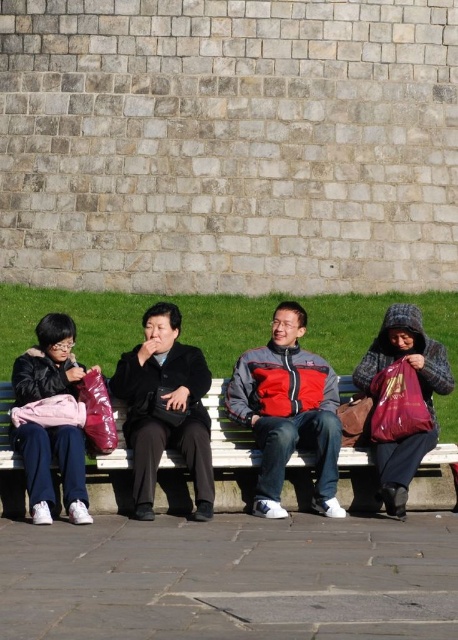
Question: Considering the real-world distances, which object is closest to the plaid woolen hat at right?

Choices:
 (A) matte black jacket at left
 (B) white wooden bench at center

Answer: (B)

Question: Considering the relative positions of white wooden bench at center and black matte coat at center in the image provided, where is white wooden bench at center located with respect to black matte coat at center?

Choices:
 (A) right
 (B) left

Answer: (A)

Question: Can you confirm if white wooden bench at center is smaller than matte black jacket at left?

Choices:
 (A) yes
 (B) no

Answer: (A)

Question: Which of these objects is positioned closest to the matte black jacket at left?

Choices:
 (A) red and gray jacket at center
 (B) plaid woolen hat at right

Answer: (A)

Question: Among these objects, which one is farthest from the camera?

Choices:
 (A) white wooden bench at center
 (B) matte black jacket at left
 (C) red and gray jacket at center

Answer: (A)

Question: Is red and gray jacket at center to the right of plaid woolen hat at right from the viewer's perspective?

Choices:
 (A) no
 (B) yes

Answer: (A)